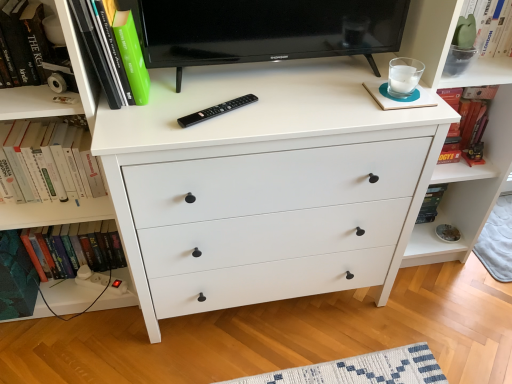
Find the location of a particular element. The image size is (512, 384). free location to the right of black plastic remote at center is located at coordinates (279, 112).